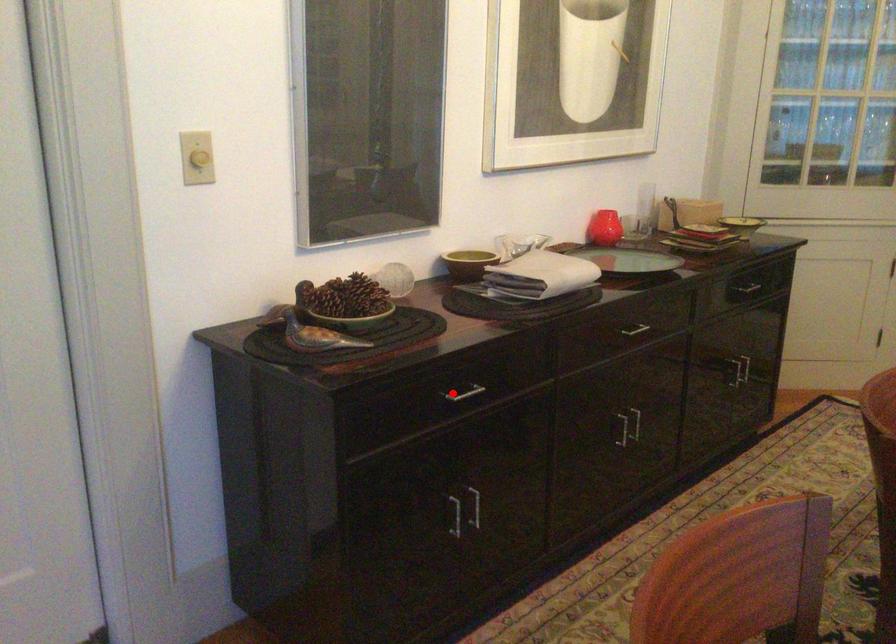
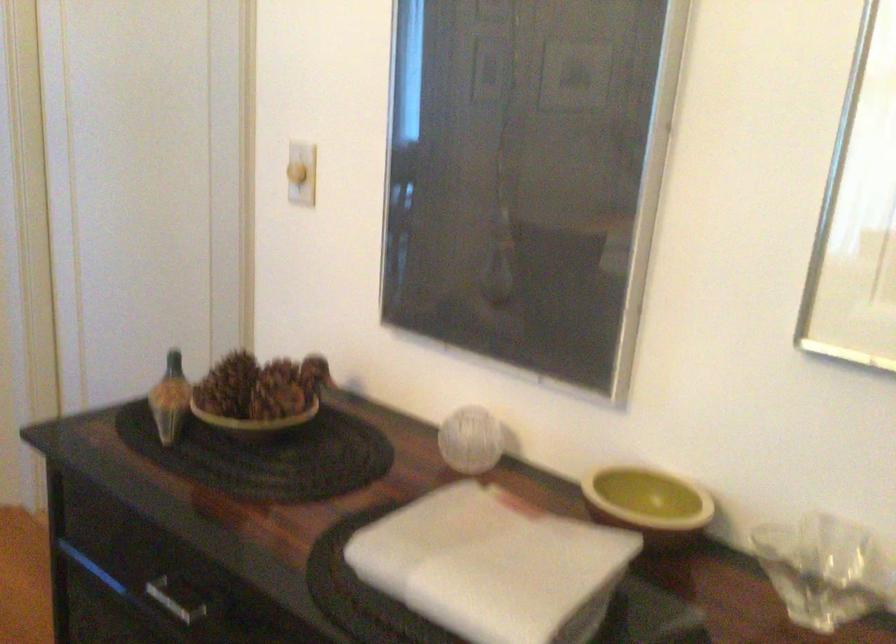
Locate, in the second image, the point that corresponds to the highlighted location in the first image.

(177, 598)